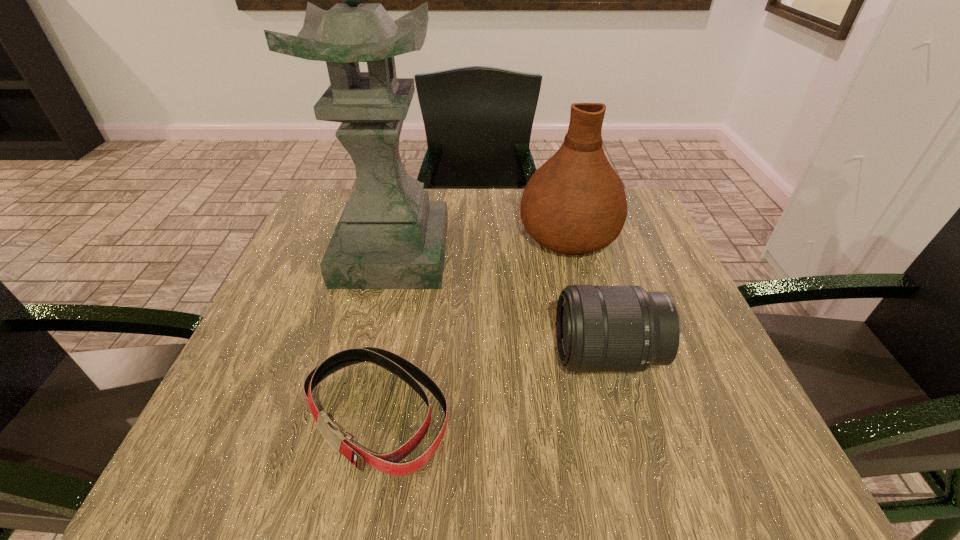
Locate an element on the screen. object that is at the far right corner is located at coordinates (575, 203).

This screenshot has height=540, width=960. I want to click on vacant space at the far edge, so click(x=472, y=197).

Locate an element on the screen. This screenshot has width=960, height=540. free space at the near edge of the desktop is located at coordinates (559, 451).

In order to click on vacant space at the left edge in this screenshot , I will do point(258,405).

Find the location of a particular element. The height and width of the screenshot is (540, 960). vacant space at the right edge of the desktop is located at coordinates (644, 288).

In the image, there is a desktop. Where is `free space at the far left corner`? This screenshot has width=960, height=540. free space at the far left corner is located at coordinates (317, 215).

In the image, there is a desktop. Where is `vacant area at the far right corner`? This screenshot has height=540, width=960. vacant area at the far right corner is located at coordinates (643, 220).

The height and width of the screenshot is (540, 960). I want to click on free area in between the sculpture and the shortest object, so click(x=385, y=334).

Image resolution: width=960 pixels, height=540 pixels. Identify the location of vacant space in between the dog collar and the telephoto lens. (492, 385).

This screenshot has height=540, width=960. Identify the location of empty space that is in between the tallest object and the dog collar. (385, 334).